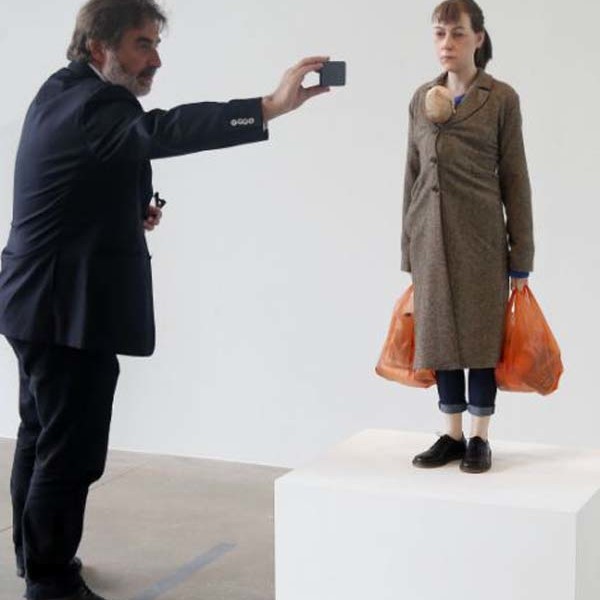
This screenshot has height=600, width=600. In order to click on phone in this screenshot , I will do `click(334, 70)`.